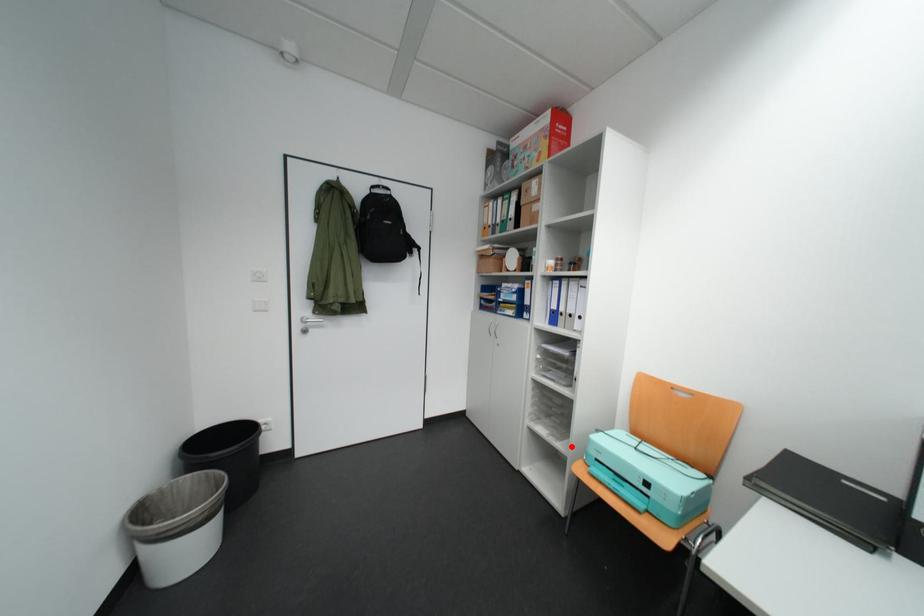
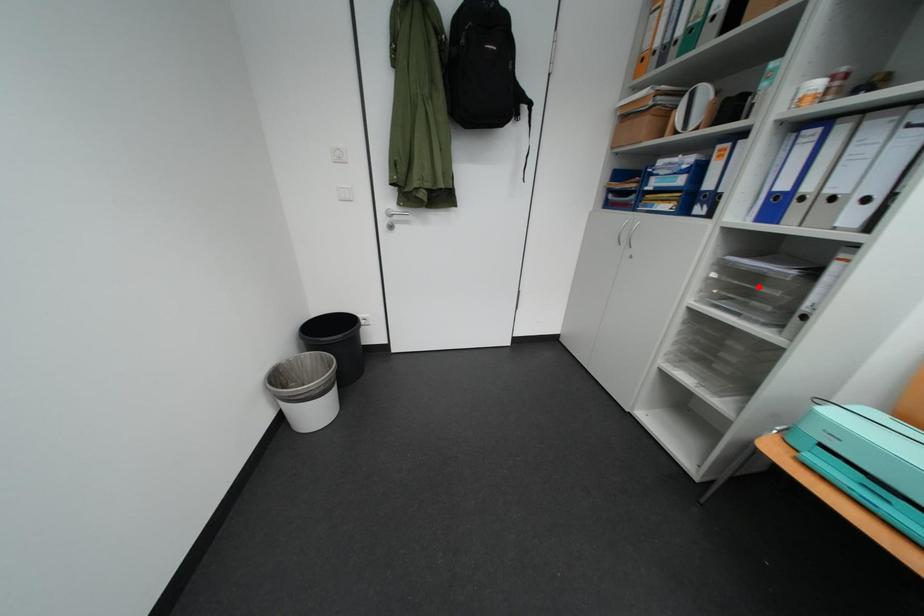
I am providing you with two images of the same scene from different viewpoints. A red point is marked on the first image and another point is marked on the second image. Is the red point in image1 aligned with the point shown in image2?

No